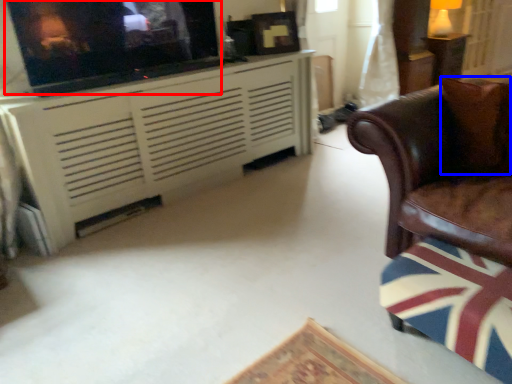
Question: Which point is further to the camera, tv show (highlighted by a red box) or pillow (highlighted by a blue box)?

Choices:
 (A) tv show
 (B) pillow

Answer: (A)